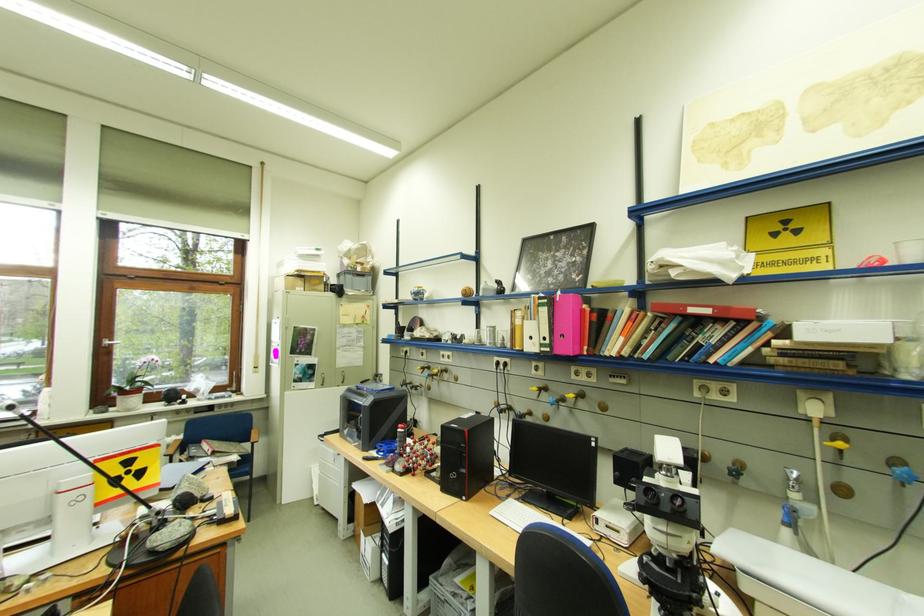
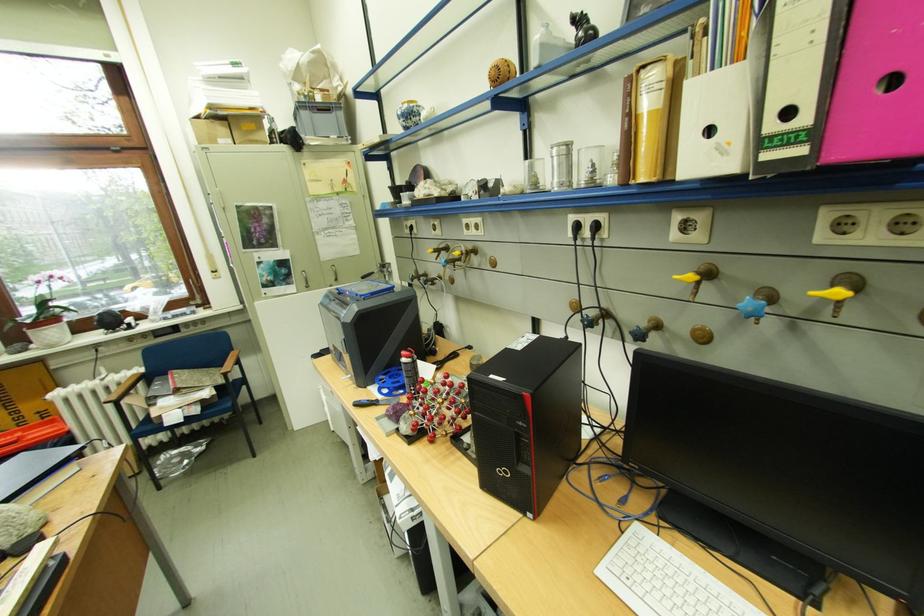
Locate, in the second image, the point that corresponds to (x=408, y=435) in the first image.

(412, 366)